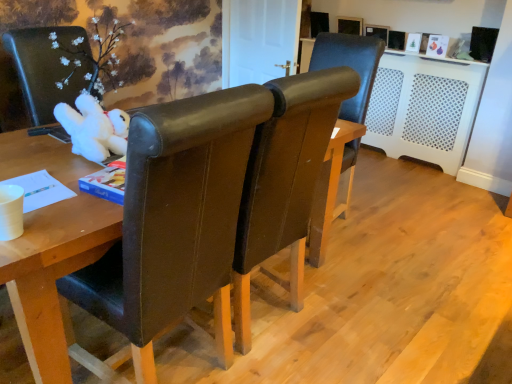
Question: Is white plush toy at left spatially inside brown leather chair at center, which is counted as the 2th chair, starting from the front, or outside of it?

Choices:
 (A) inside
 (B) outside

Answer: (B)

Question: Looking at the image, does white plush toy at left seem bigger or smaller compared to brown leather chair at center, which is counted as the 2th chair, starting from the front?

Choices:
 (A) big
 (B) small

Answer: (B)

Question: Estimate the real-world distances between objects in this image. Which object is farther from the brown leather chair at center, the third chair positioned from the front?

Choices:
 (A) brown leather chair at center, the 3th chair positioned from the back
 (B) white plush toy at left
 (C) white perforated plastic radiator at right
 (D) brown leather chair at center, which is counted as the second chair, starting from the back

Answer: (B)

Question: Based on their relative distances, which object is nearer to the brown leather chair at center, which is counted as the second chair, starting from the back?

Choices:
 (A) brown leather chair at center, acting as the first chair starting from the front
 (B) white perforated plastic radiator at right
 (C) white plush toy at left
 (D) brown leather chair at center, the third chair positioned from the front

Answer: (A)